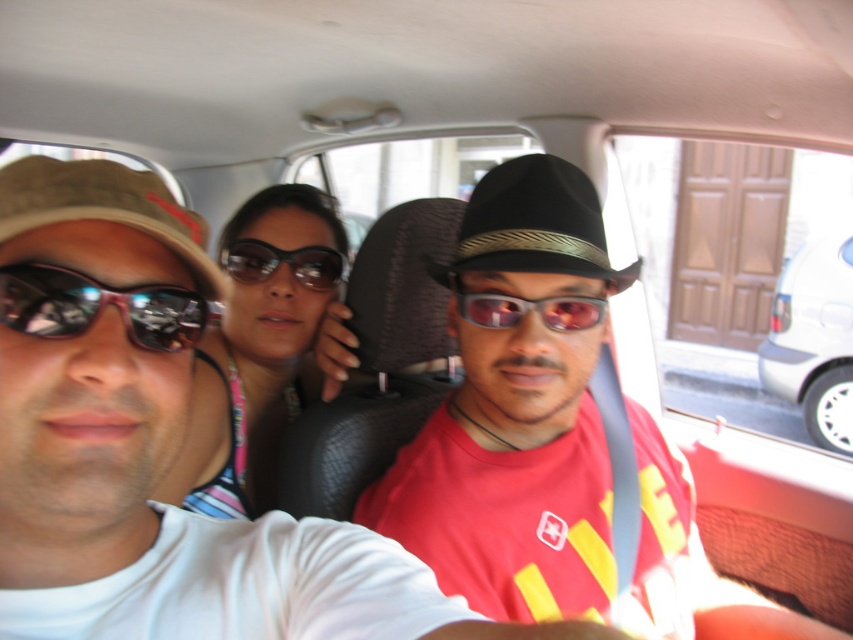
Question: Is matte black sunglasses at center smaller than brown fabric cowboy hat at left?

Choices:
 (A) yes
 (B) no

Answer: (B)

Question: Which point appears farthest from the camera in this image?

Choices:
 (A) (235, 378)
 (B) (805, 336)

Answer: (B)

Question: Which of the following is the closest to the observer?

Choices:
 (A) (144, 300)
 (B) (13, 224)
 (C) (293, 209)

Answer: (B)

Question: Does reflective plastic goggles at center lie behind shiny black sunglasses at center?

Choices:
 (A) no
 (B) yes

Answer: (A)

Question: Can you confirm if black felt cowboy hat at center is bigger than brown fabric cowboy hat at left?

Choices:
 (A) no
 (B) yes

Answer: (B)

Question: Which is farther from the white glossy car at right?

Choices:
 (A) reflective plastic goggles at center
 (B) black felt cowboy hat at center

Answer: (A)